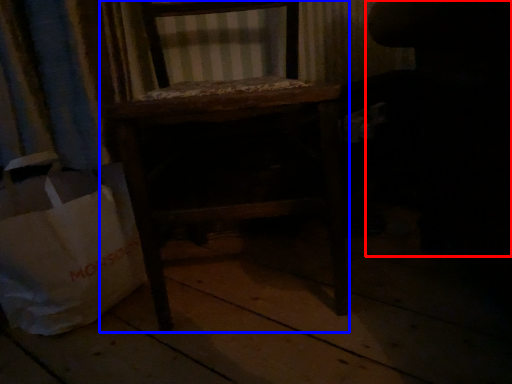
Question: Which point is closer to the camera, swivel chair (highlighted by a red box) or furniture (highlighted by a blue box)?

Choices:
 (A) swivel chair
 (B) furniture

Answer: (B)